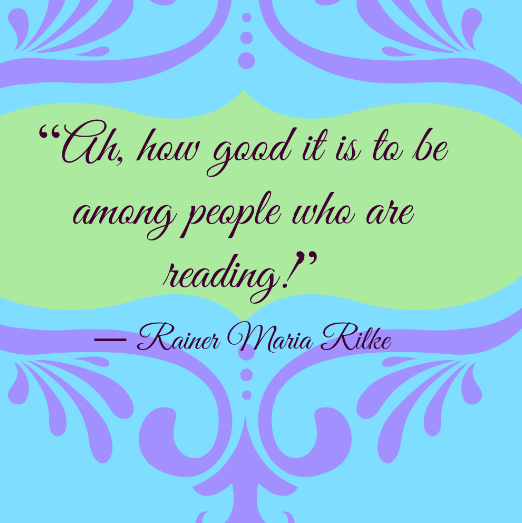
Find the location of a particular element. purple decoration in upper part of background is located at coordinates (245, 55), (245, 34), (242, 18).